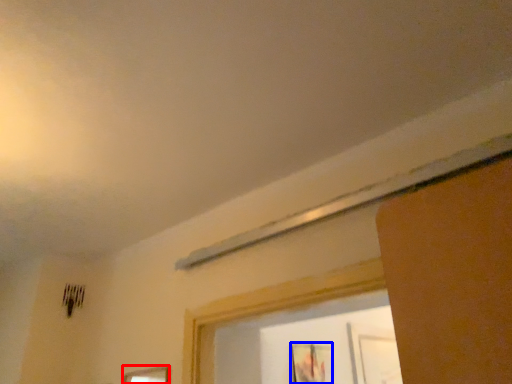
Question: Among these objects, which one is farthest to the camera, picture frame (highlighted by a red box) or picture frame (highlighted by a blue box)?

Choices:
 (A) picture frame
 (B) picture frame

Answer: (B)